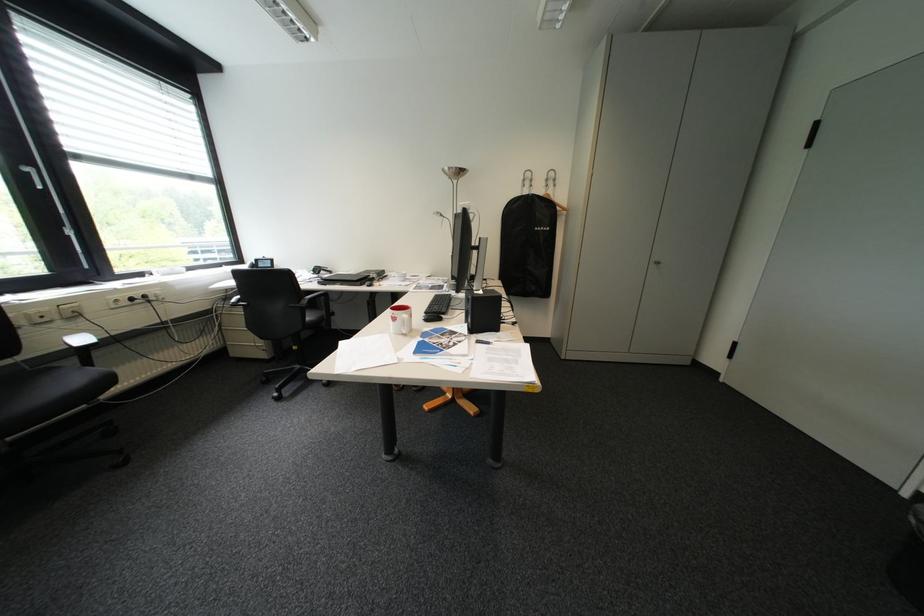
Image resolution: width=924 pixels, height=616 pixels. Find the location of `silver cabinet handle`. silver cabinet handle is located at coordinates (31, 175).